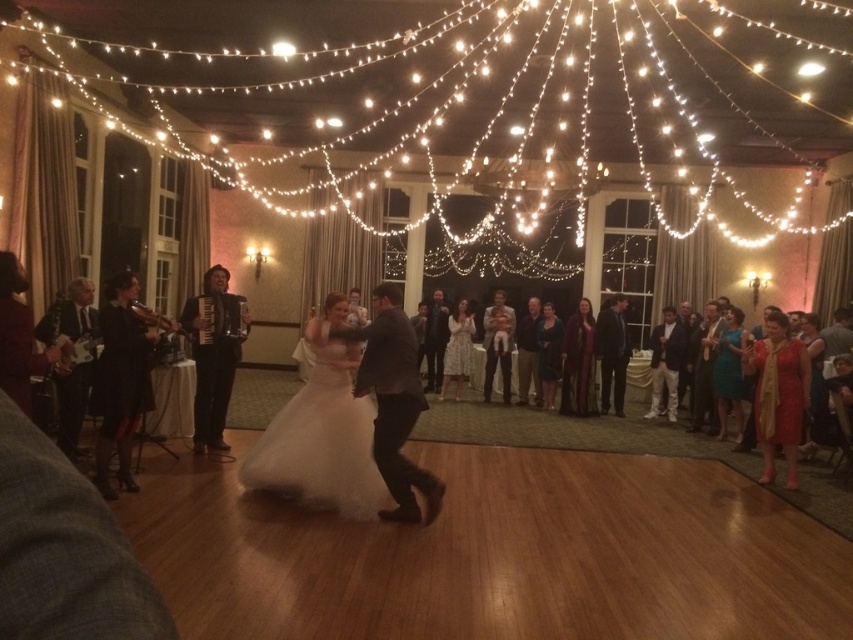
Which is more to the left, white satin dress at center or black leather accordion at center?

black leather accordion at center is more to the left.

Who is positioned more to the right, white satin dress at center or black leather accordion at center?

From the viewer's perspective, white satin dress at center appears more on the right side.

The width and height of the screenshot is (853, 640). I want to click on white satin dress at center, so coord(321,429).

Where is `white satin dress at center`? Image resolution: width=853 pixels, height=640 pixels. white satin dress at center is located at coordinates [x=321, y=429].

Between white satin dress at center and red satin dress at right, which one appears on the right side from the viewer's perspective?

red satin dress at right is more to the right.

Who is more distant from viewer, (341, 500) or (764, 438)?

Point (764, 438)

Is point (360, 488) closer to camera compared to point (762, 412)?

Yes.

The width and height of the screenshot is (853, 640). Find the location of `white satin dress at center`. white satin dress at center is located at coordinates (321, 429).

Consider the image. Does black leather accordion at center appear over red satin dress at right?

Indeed, black leather accordion at center is positioned over red satin dress at right.

Between black leather accordion at center and red satin dress at right, which one is positioned lower?

red satin dress at right is below.

Which is in front, point (199, 385) or point (776, 433)?

Point (776, 433)

The height and width of the screenshot is (640, 853). What are the coordinates of `black leather accordion at center` in the screenshot? It's located at [x=213, y=355].